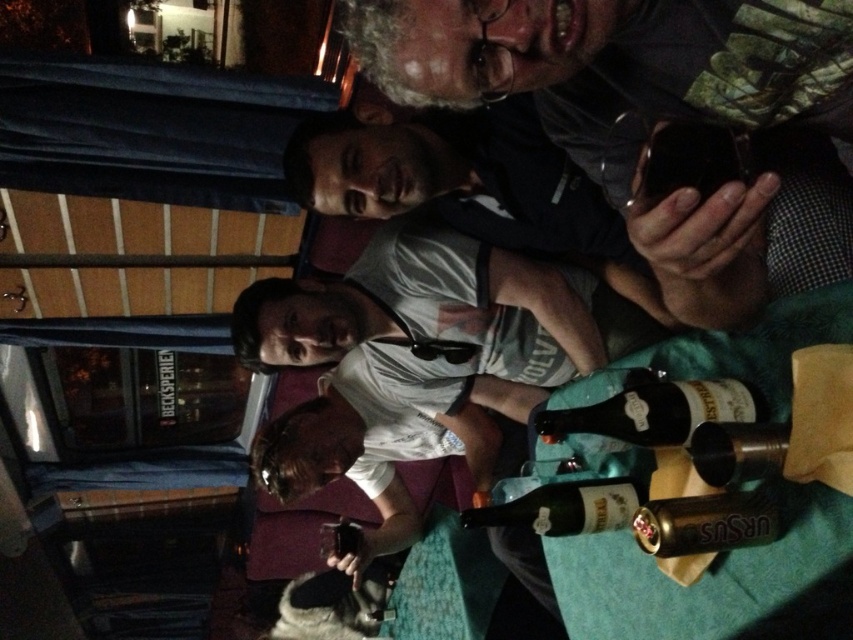
Consider the image. You are at a bar with friends and want to grab a drink. There are two bottles on the table in front of you. One is a translucent glass bottle at lower center and the other is a metallic silver bottle at center. Which one should you choose if you want the larger bottle?

The translucent glass bottle at lower center is bigger than the metallic silver bottle at center, so you should choose the translucent glass bottle at lower center.

You are at a bar and want to grab a drink from the table. There are two bottles at the center of the table. Which one is taller, the translucent glass bottle at center or the metallic silver bottle at center?

The translucent glass bottle at center is taller than the metallic silver bottle at center according to the description.

You are a photographer trying to capture a candid shot of the metallic silver bottle at center without including the matte black phone at upper center in the frame. Based on their positions, is this possible?

The matte black phone at upper center is to the left of the metallic silver bottle at center, so if you position your camera to the right side of the bottle, you can capture the bottle without the phone appearing in the frame.